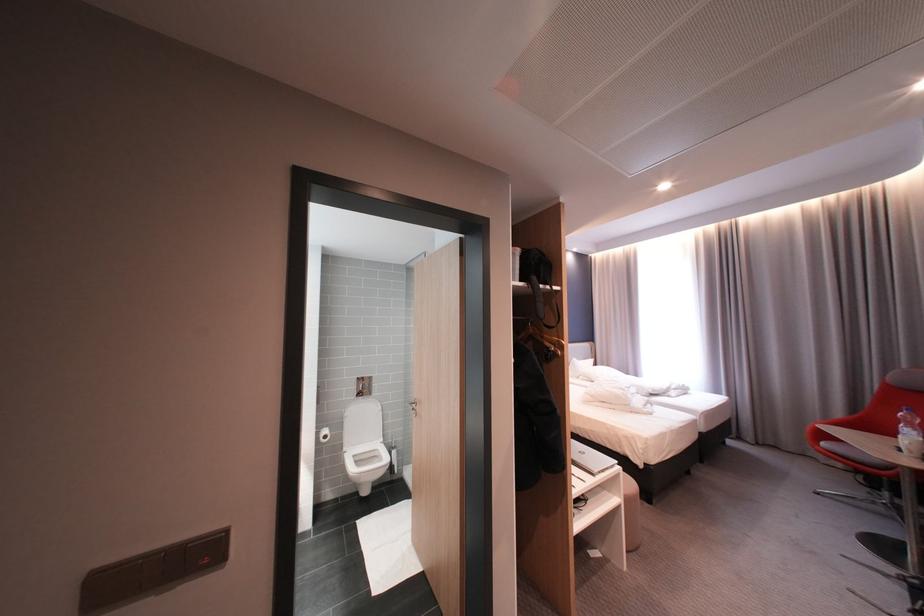
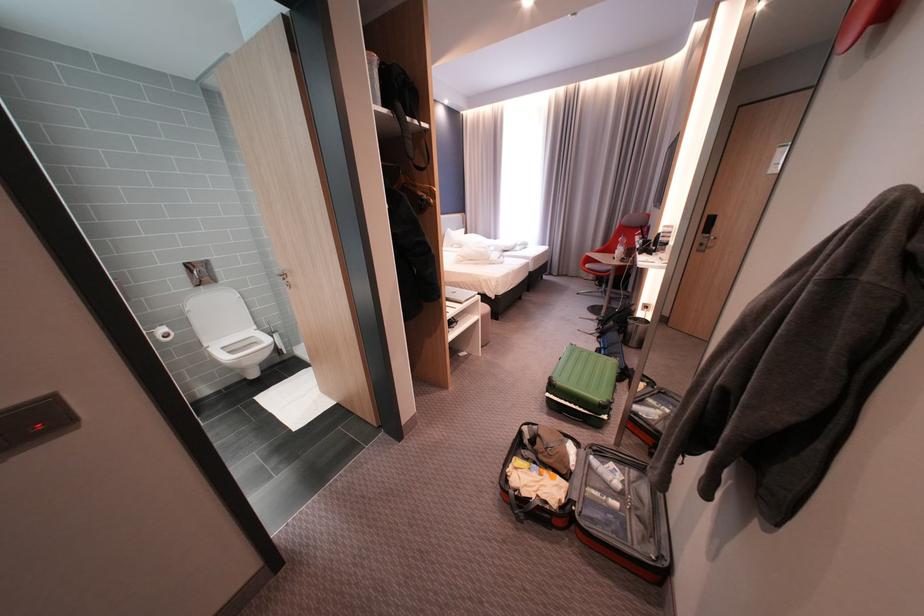
Where in the second image is the point corresponding to point 556,352 from the first image?

(431, 203)